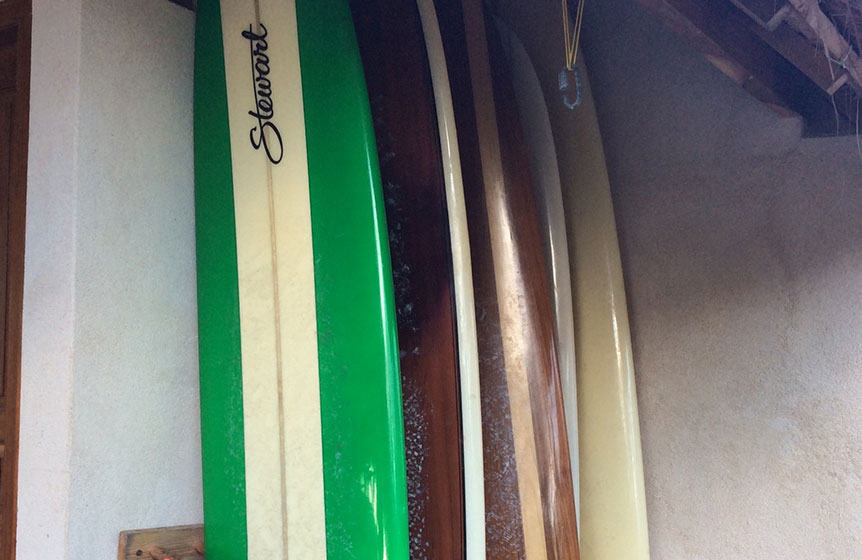
The width and height of the screenshot is (862, 560). Find the location of `cobweb`. cobweb is located at coordinates (848, 28).